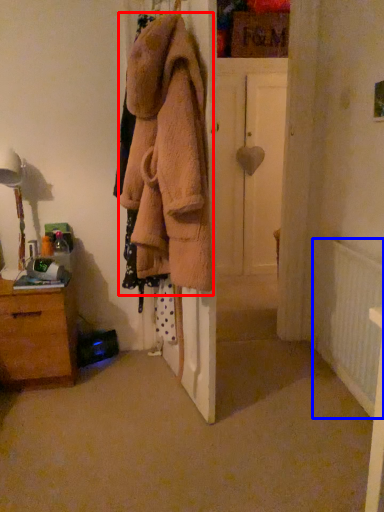
Question: Among these objects, which one is farthest to the camera, clothing (highlighted by a red box) or radiator (highlighted by a blue box)?

Choices:
 (A) clothing
 (B) radiator

Answer: (B)